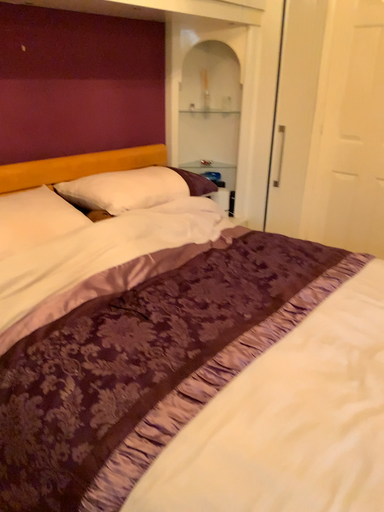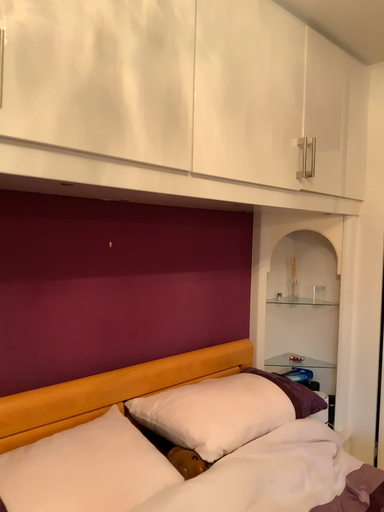
Question: Which way did the camera rotate in the video?

Choices:
 (A) rotated downward
 (B) rotated upward

Answer: (B)